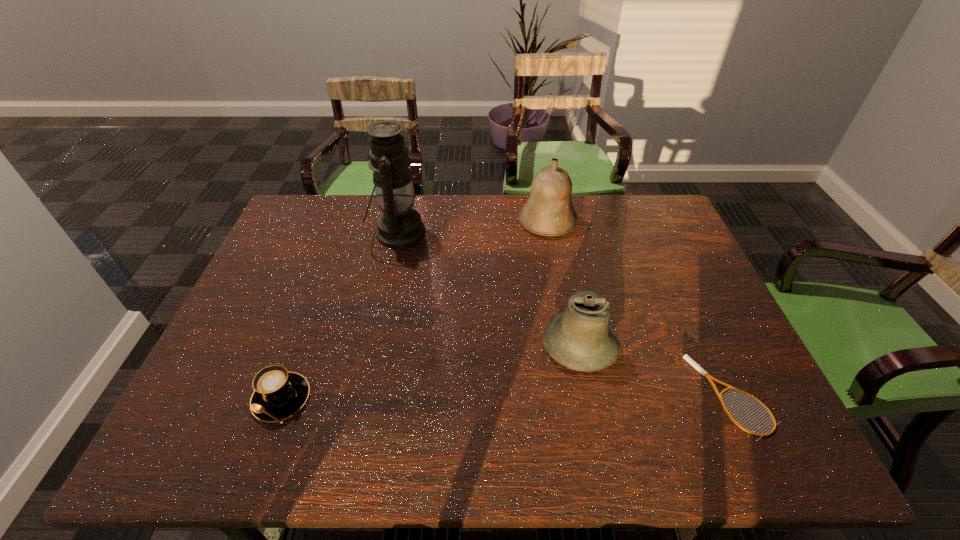
Identify the location of object that is at the right edge. This screenshot has width=960, height=540. tap(686, 357).

Where is `object present at the near left corner`? The width and height of the screenshot is (960, 540). object present at the near left corner is located at coordinates (278, 394).

Where is `object that is positioned at the near right corner`? The height and width of the screenshot is (540, 960). object that is positioned at the near right corner is located at coordinates (686, 357).

This screenshot has height=540, width=960. I want to click on free space at the far edge of the desktop, so click(457, 210).

The image size is (960, 540). What are the coordinates of `vacant space at the near edge of the desktop` in the screenshot? It's located at (514, 438).

The width and height of the screenshot is (960, 540). I want to click on vacant space at the left edge, so click(x=285, y=244).

I want to click on blank space at the right edge of the desktop, so 670,263.

Find the location of a particular element. vacant area at the far left corner is located at coordinates (321, 236).

Image resolution: width=960 pixels, height=540 pixels. Identify the location of free space at the near left corner of the desktop. (215, 451).

Find the location of a particular element. vacant space at the far right corner of the desktop is located at coordinates (679, 231).